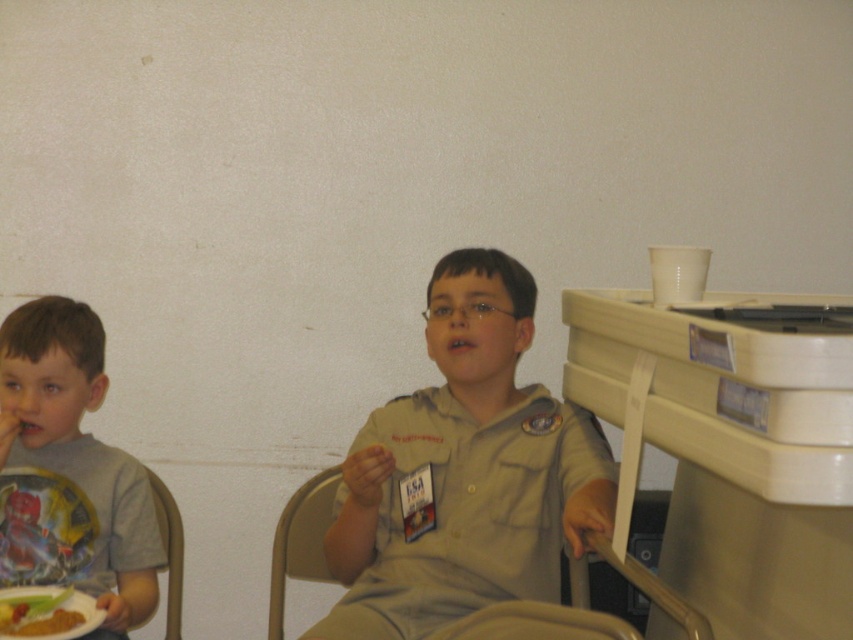
Question: Estimate the real-world distances between objects in this image. Which object is farther from the gray fabric chair at left?

Choices:
 (A) khaki uniform shirt at center
 (B) white plastic table at right

Answer: (B)

Question: Considering the relative positions of white plastic table at right and khaki uniform shirt at center in the image provided, where is white plastic table at right located with respect to khaki uniform shirt at center?

Choices:
 (A) right
 (B) left

Answer: (A)

Question: Is white plastic table at right above golden brown bread at lower left?

Choices:
 (A) yes
 (B) no

Answer: (A)

Question: Is khaki uniform shirt at center to the left of gray cotton shirt at left from the viewer's perspective?

Choices:
 (A) yes
 (B) no

Answer: (B)

Question: Which point is closer to the camera?

Choices:
 (A) khaki uniform shirt at center
 (B) gray fabric chair at left
 (C) metallic gray chair at center
 (D) gray cotton shirt at left

Answer: (A)

Question: Which of the following is the closest to the observer?

Choices:
 (A) khaki uniform shirt at center
 (B) white plastic table at right
 (C) gray cotton shirt at left

Answer: (B)